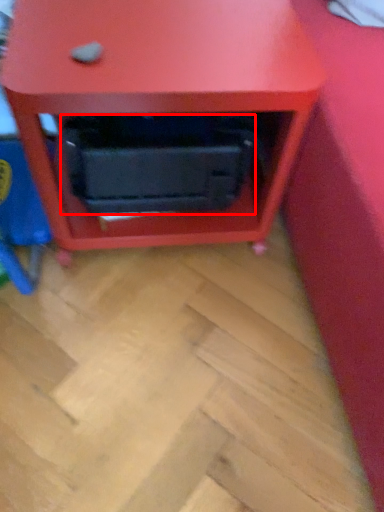
Question: In this image, where is drawer (annotated by the red box) located relative to furniture?

Choices:
 (A) right
 (B) left

Answer: (B)